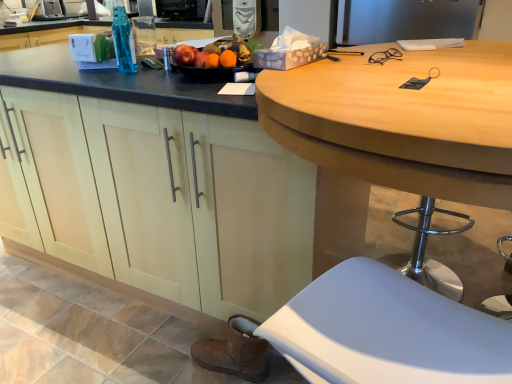
Identify the location of free space behind clear plastic glasses at upper right. (378, 54).